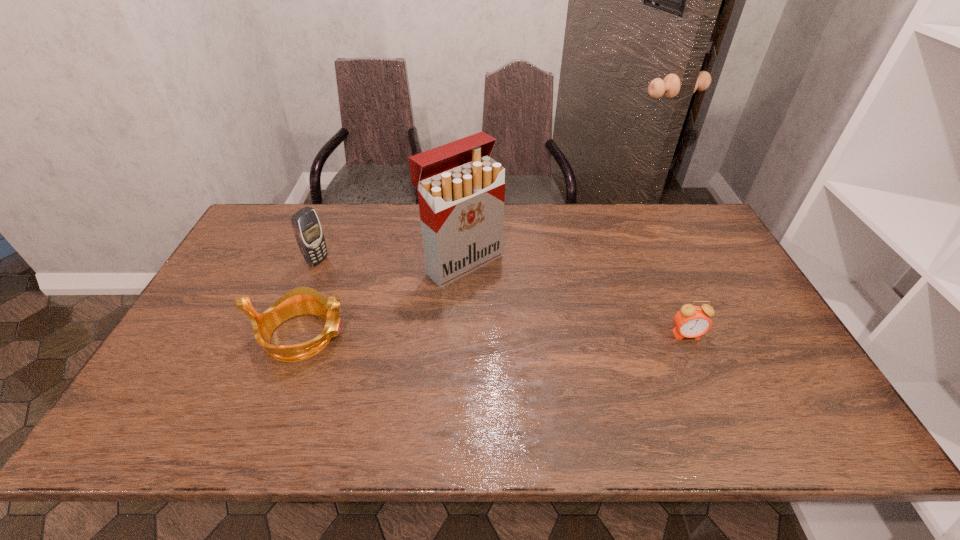
This screenshot has width=960, height=540. Identify the location of free space located with the lid open on the cigarette case. (551, 336).

Image resolution: width=960 pixels, height=540 pixels. I want to click on vacant region located with the lid open on the cigarette case, so click(499, 292).

I want to click on vacant area situated 0.360m with the lid open on the cigarette case, so click(579, 361).

Identify the location of object located in the far edge section of the desktop. This screenshot has height=540, width=960. (461, 190).

Identify the location of vacant space at the far edge. This screenshot has width=960, height=540. (526, 208).

Where is `free space at the near edge of the desktop`? The image size is (960, 540). free space at the near edge of the desktop is located at coordinates (609, 387).

This screenshot has width=960, height=540. What are the coordinates of `free space at the left edge of the desktop` in the screenshot? It's located at (205, 354).

The width and height of the screenshot is (960, 540). In the image, there is a desktop. Identify the location of vacant area at the right edge. click(776, 339).

Identify the location of free space at the far left corner of the desktop. (252, 241).

Find the location of a particular element. vacant space at the near left corner of the desktop is located at coordinates (205, 388).